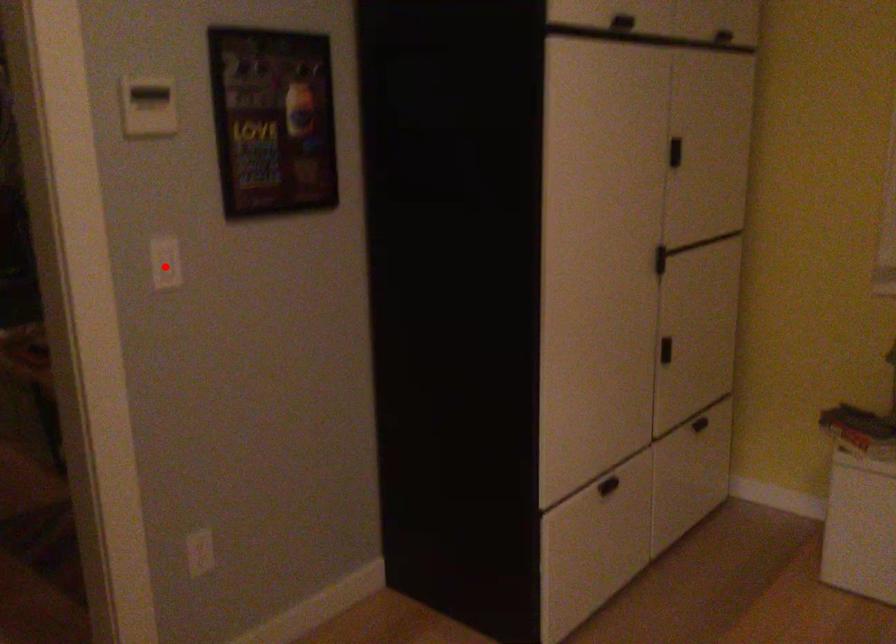
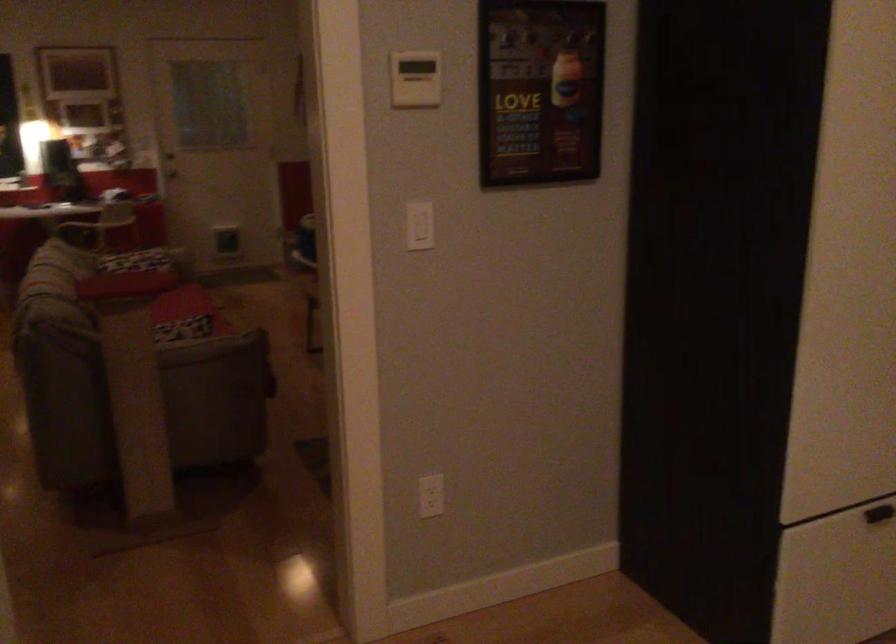
The point at the highlighted location is marked in the first image. Where is the corresponding point in the second image?

(419, 225)